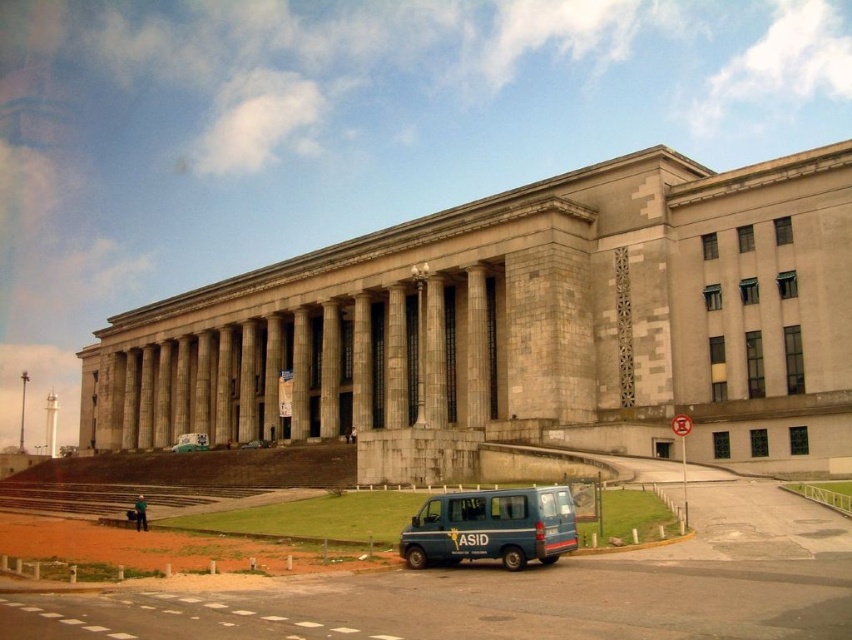
Is blue metallic van at lower center to the right of metallic blue van at center from the viewer's perspective?

Yes, blue metallic van at lower center is to the right of metallic blue van at center.

What do you see at coordinates (491, 528) in the screenshot? This screenshot has width=852, height=640. I see `blue metallic van at lower center` at bounding box center [491, 528].

Locate an element on the screen. blue metallic van at lower center is located at coordinates (491, 528).